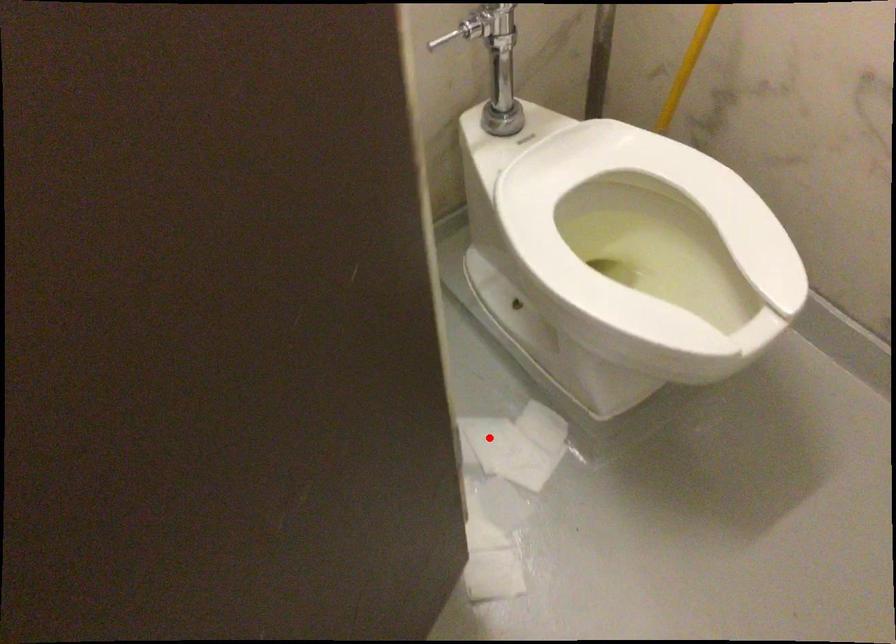
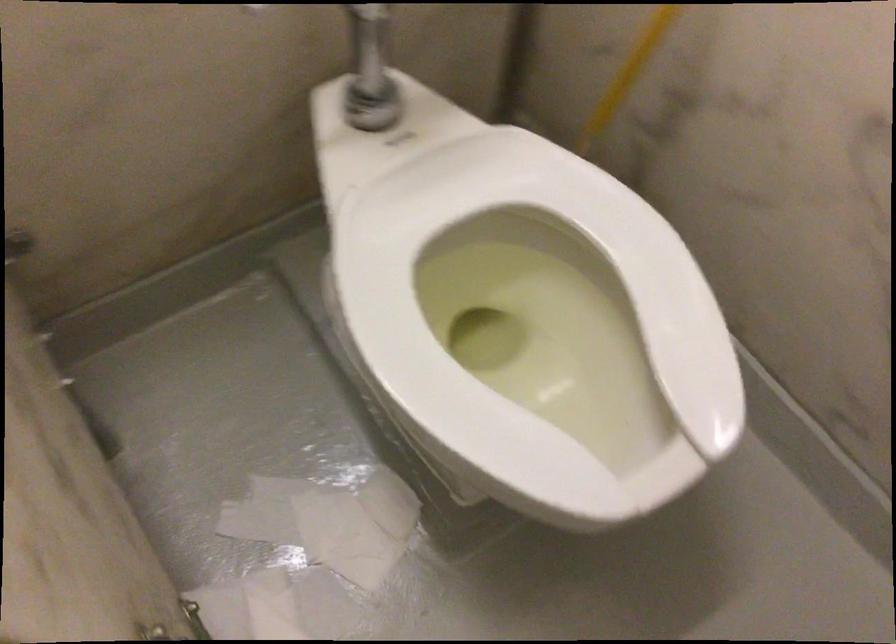
Question: I am providing you with two images of the same scene from different viewpoints. Given a red point in image1, look at the same physical point in image2. Is it:

Choices:
 (A) Closer to the viewpoint
 (B) Farther from the viewpoint

Answer: (A)